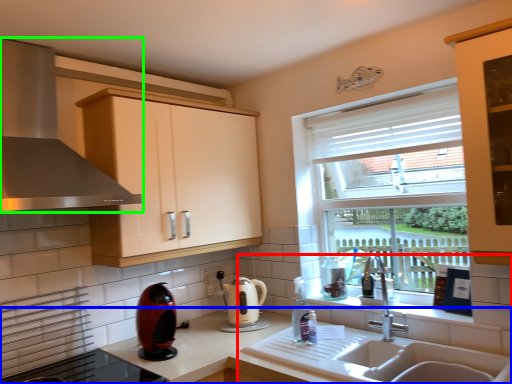
Question: Considering the real-world distances, which object is closest to sink (highlighted by a red box)? countertop (highlighted by a blue box) or home appliance (highlighted by a green box).

Choices:
 (A) countertop
 (B) home appliance

Answer: (A)